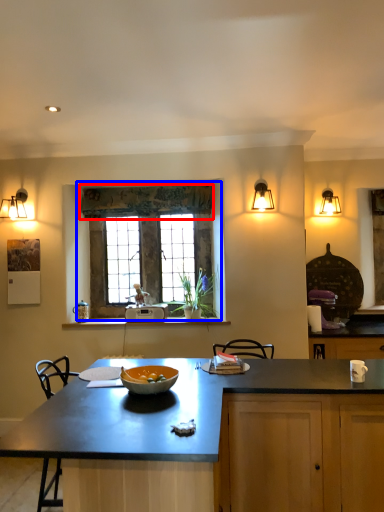
Question: Among these objects, which one is farthest to the camera, curtain (highlighted by a red box) or window (highlighted by a blue box)?

Choices:
 (A) curtain
 (B) window

Answer: (B)